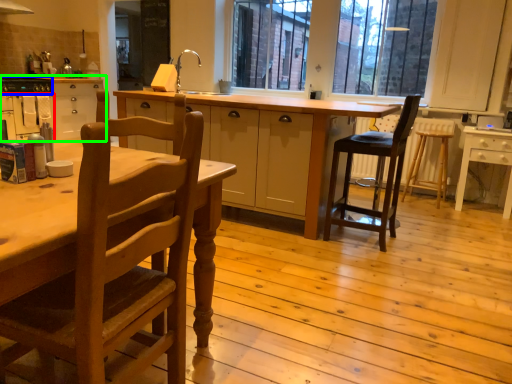
Question: Considering the real-world distances, which object is farthest from oven (highlighted by a red box)? appliance (highlighted by a blue box) or cabinetry (highlighted by a green box)?

Choices:
 (A) appliance
 (B) cabinetry

Answer: (A)